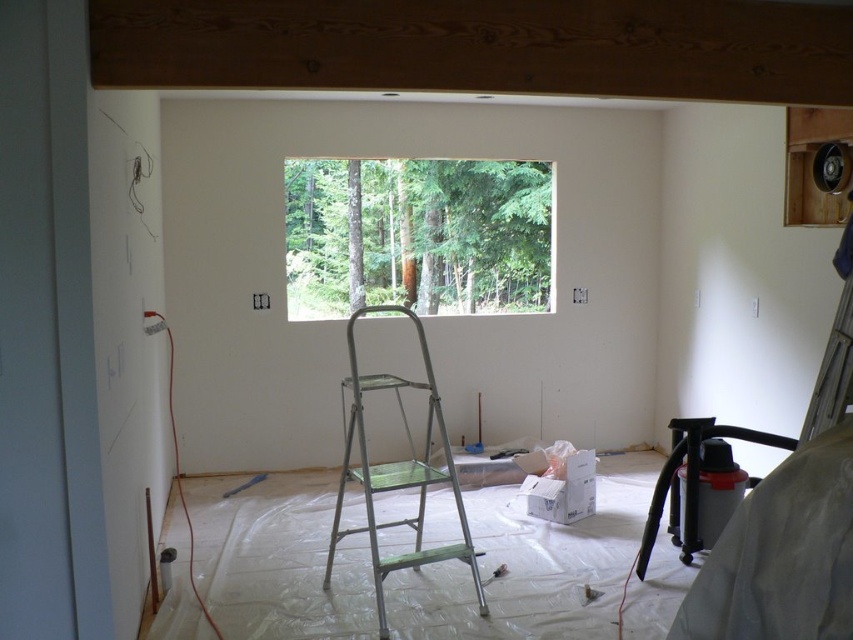
From the picture: Between transparent glass window at center and metallic silver step ladder at center, which one has less height?

transparent glass window at center is shorter.

Which is more to the left, transparent glass window at center or metallic silver step ladder at center?

metallic silver step ladder at center is more to the left.

The height and width of the screenshot is (640, 853). Find the location of `transparent glass window at center`. transparent glass window at center is located at coordinates point(416,236).